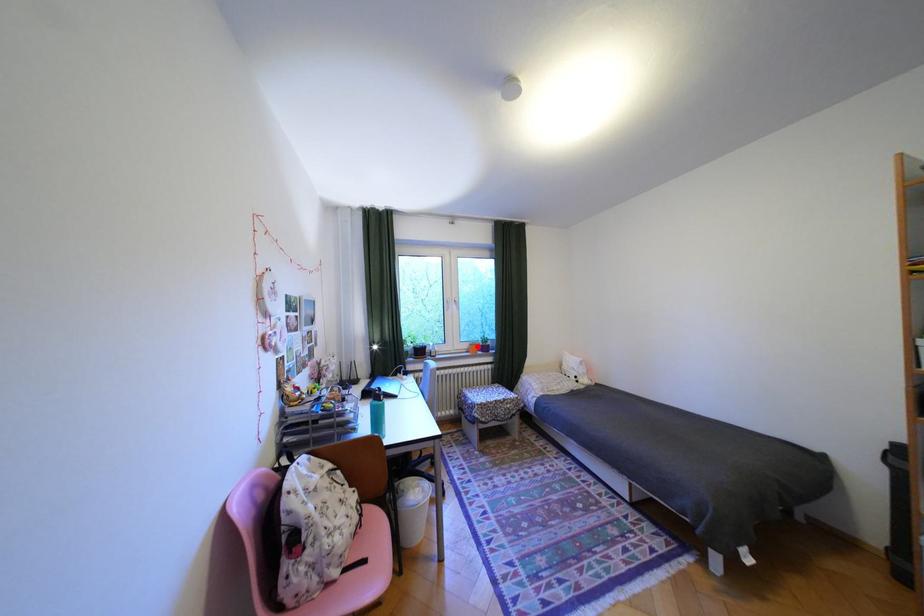
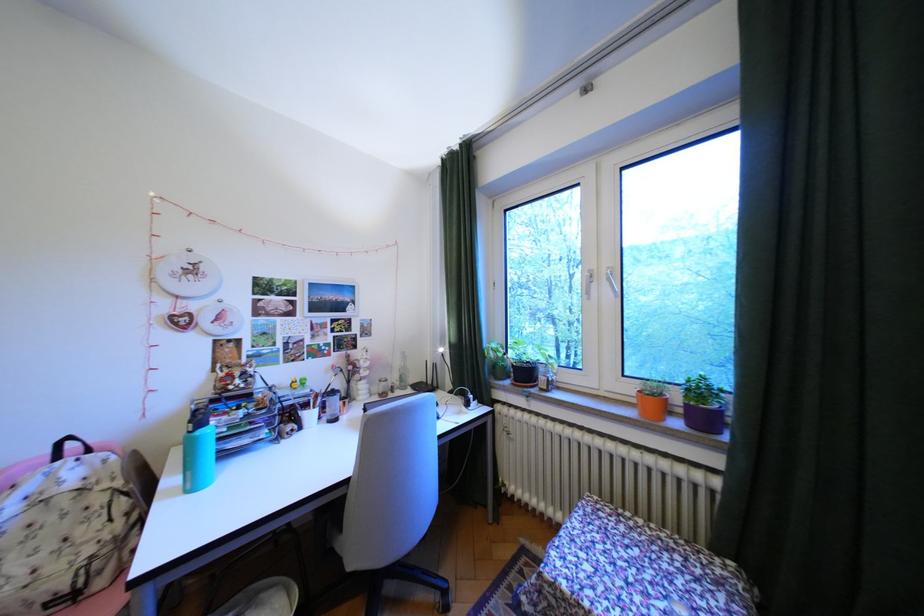
Find the pixel in the second image that matches the highlighted location in the first image.

(641, 390)